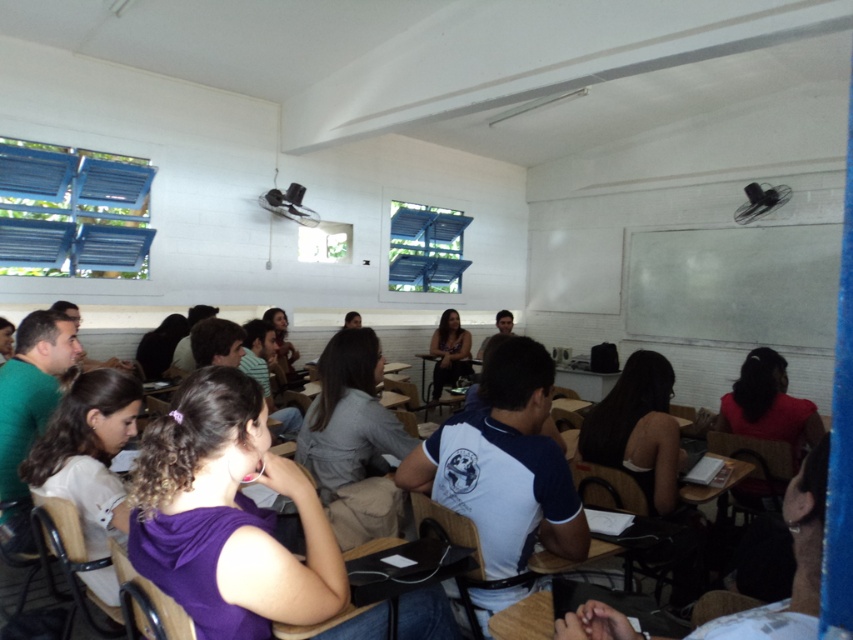
You are a student sitting at the back of the classroom. You need to write something on the white matte chalkboard at upper right, but you have to pass by the matte black dress at center. Considering their sizes, which object will block your view more when you walk towards the chalkboard?

The white matte chalkboard at upper right will block your view more because it has a larger size compared to the matte black dress at center.

You are a student who wants to write a message on the white matte chalkboard at upper right without moving your chair from the matte black dress at center. Is the chalkboard wide enough for you to write a message that is as wide as the dress?

The white matte chalkboard at upper right is wider than the matte black dress at center, so yes, the chalkboard is wide enough to write a message as wide as the dress.

In the scene shown: You are a student sitting in the classroom and want to write something on the white matte chalkboard at upper right. Considering your height is 1.6 meters, can you reach the board without any assistance?

The white matte chalkboard at upper right is 6.08 meters away from the viewer. Since the distance is quite far, a student of 1.6 meters height would not be able to reach the board without assistance.